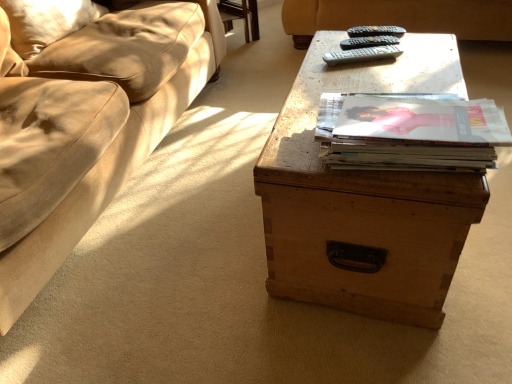
Locate an element on the screen. The width and height of the screenshot is (512, 384). vacant space in front of gray plastic remote at upper center, which ranks as the first remote in bottom-to-top order is located at coordinates (385, 75).